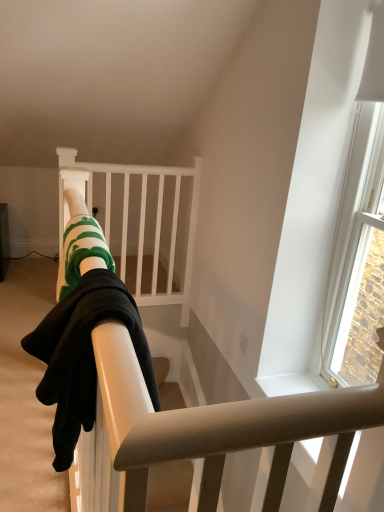
The image size is (384, 512). What are the coordinates of `white matte wooden crib at upper center` in the screenshot? It's located at (144, 224).

Image resolution: width=384 pixels, height=512 pixels. What do you see at coordinates (144, 224) in the screenshot?
I see `white matte wooden crib at upper center` at bounding box center [144, 224].

What is the approximate width of green striped socks at center?

green striped socks at center is 9.20 inches in width.

Identify the location of green striped socks at center. This screenshot has width=384, height=512. (75, 203).

What do you see at coordinates (75, 203) in the screenshot? I see `green striped socks at center` at bounding box center [75, 203].

The image size is (384, 512). Identify the location of white matte wooden crib at upper center. (144, 224).

Considering the relative positions of white matte wooden crib at upper center and green striped socks at center in the image provided, is white matte wooden crib at upper center to the left of green striped socks at center from the viewer's perspective?

Yes.

In the image, is white matte wooden crib at upper center positioned in front of or behind green striped socks at center?

Visually, white matte wooden crib at upper center is located behind green striped socks at center.

Is point (160, 210) closer or farther from the camera than point (84, 228)?

Point (160, 210) appears to be farther away from the viewer than point (84, 228).

From the image's perspective, which object appears higher, white matte wooden crib at upper center or green striped socks at center?

white matte wooden crib at upper center, from the image's perspective.

From a real-world perspective, who is located higher, white matte wooden crib at upper center or green striped socks at center?

green striped socks at center.

Between white matte wooden crib at upper center and green striped socks at center, which one has smaller width?

white matte wooden crib at upper center is thinner.

Does white matte wooden crib at upper center have a lesser height compared to green striped socks at center?

No.

Which of these two, white matte wooden crib at upper center or green striped socks at center, is bigger?

Bigger between the two is white matte wooden crib at upper center.

Is white matte wooden crib at upper center completely or partially outside of green striped socks at center?

Indeed, white matte wooden crib at upper center is completely outside green striped socks at center.

Are white matte wooden crib at upper center and green striped socks at center located far from each other?

white matte wooden crib at upper center is far away from green striped socks at center.

Does white matte wooden crib at upper center turn towards green striped socks at center?

Yes, white matte wooden crib at upper center faces towards green striped socks at center.

Identify the location of infant bed below the green striped socks at center (from a real-world perspective). This screenshot has height=512, width=384. (144, 224).

Visually, is green striped socks at center positioned to the left or to the right of white matte wooden crib at upper center?

From the image, it's evident that green striped socks at center is to the right of white matte wooden crib at upper center.

Between green striped socks at center and white matte wooden crib at upper center, which one is positioned behind?

white matte wooden crib at upper center is further away from the camera.

Between point (85, 271) and point (184, 321), which one is positioned behind?

The point (184, 321) is farther from the camera.

From the picture: From the image's perspective, is green striped socks at center located beneath white matte wooden crib at upper center?

Yes, from the image's perspective, green striped socks at center is below white matte wooden crib at upper center.

From a real-world perspective, is green striped socks at center over white matte wooden crib at upper center?

Yes.

Which object is wider, green striped socks at center or white matte wooden crib at upper center?

With larger width is green striped socks at center.

Does green striped socks at center have a greater height compared to white matte wooden crib at upper center?

Incorrect, the height of green striped socks at center is not larger of that of white matte wooden crib at upper center.

Between green striped socks at center and white matte wooden crib at upper center, which one has larger size?

white matte wooden crib at upper center.

Is green striped socks at center not inside white matte wooden crib at upper center?

Yes, green striped socks at center is not within white matte wooden crib at upper center.

Are green striped socks at center and white matte wooden crib at upper center far apart?

green striped socks at center is positioned a significant distance from white matte wooden crib at upper center.

Could you tell me if green striped socks at center is turned towards white matte wooden crib at upper center?

No, green striped socks at center is not oriented towards white matte wooden crib at upper center.

What's the angular difference between green striped socks at center and white matte wooden crib at upper center's facing directions?

They differ by 89.7 degrees in their facing directions.

Locate an element on the screen. infant bed above the green striped socks at center (from the image's perspective) is located at coordinates (144, 224).

Where is `person on the right of white matte wooden crib at upper center`? person on the right of white matte wooden crib at upper center is located at coordinates (75, 203).

Image resolution: width=384 pixels, height=512 pixels. I want to click on person lying below the white matte wooden crib at upper center (from the image's perspective), so click(75, 203).